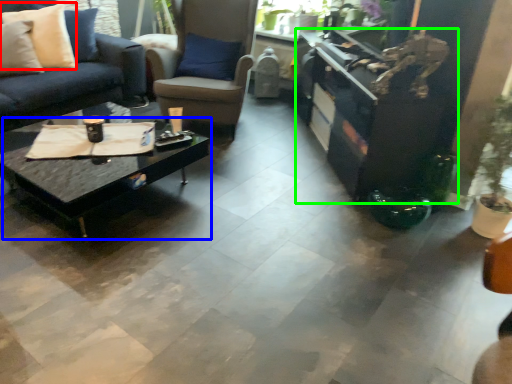
Question: Estimate the real-world distances between objects in this image. Which object is farther from pillow (highlighted by a red box), coffee table (highlighted by a blue box) or entertainment center (highlighted by a green box)?

Choices:
 (A) coffee table
 (B) entertainment center

Answer: (B)